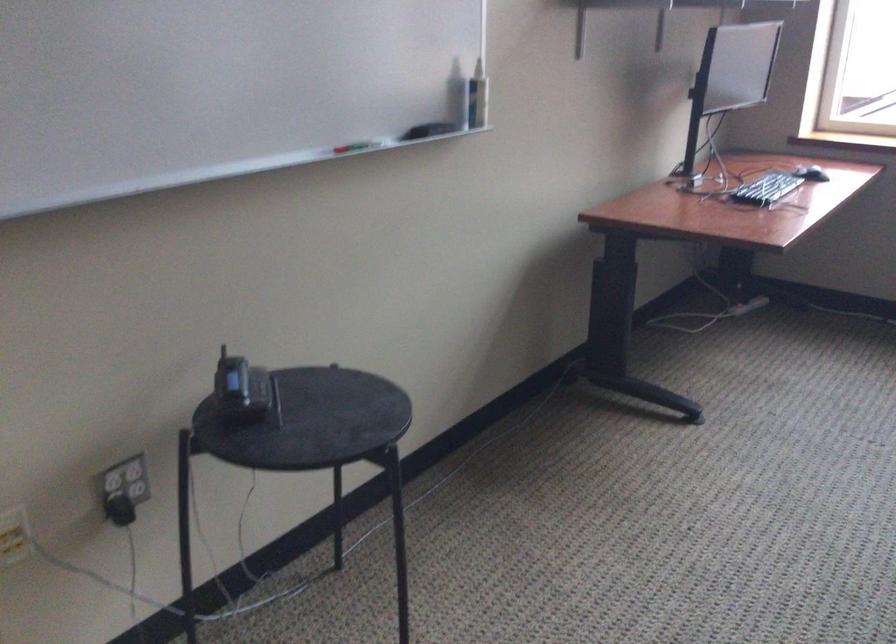
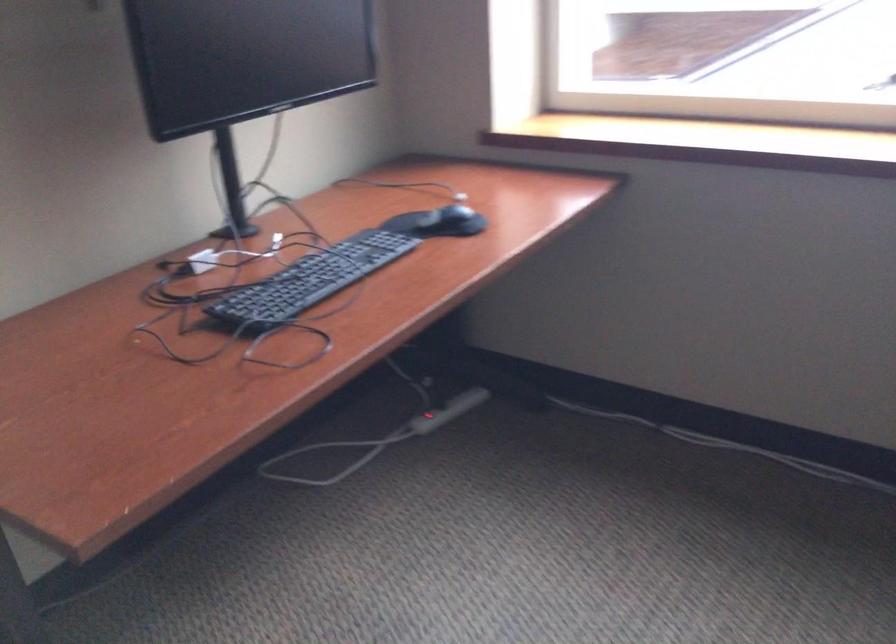
The images are taken continuously from a first-person perspective. In which direction are you moving?

The movement direction of the cameraman is right, forward.